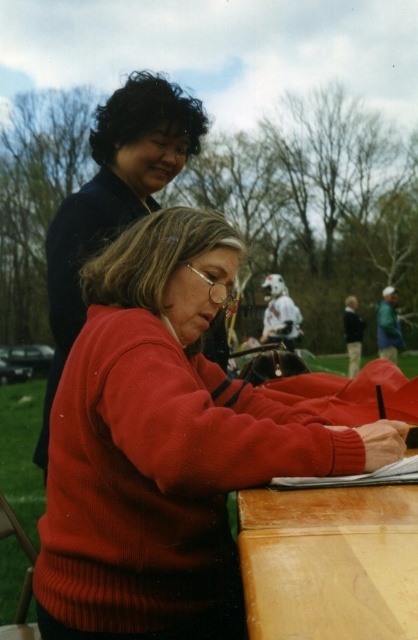
Question: Which of the following is the farthest from the observer?

Choices:
 (A) matte black sweater at upper left
 (B) knitted red sweater at center

Answer: (A)

Question: Is knitted red sweater at center smaller than matte black sweater at upper left?

Choices:
 (A) no
 (B) yes

Answer: (B)

Question: Which of the following is the closest to the observer?

Choices:
 (A) knitted red sweater at center
 (B) wooden table at lower center

Answer: (B)

Question: Does wooden table at lower center have a greater width compared to matte black sweater at upper left?

Choices:
 (A) no
 (B) yes

Answer: (A)

Question: Among these objects, which one is nearest to the camera?

Choices:
 (A) matte black sweater at upper left
 (B) knitted red sweater at center
 (C) wooden table at lower center

Answer: (C)

Question: Considering the relative positions of knitted red sweater at center and matte black sweater at upper left in the image provided, where is knitted red sweater at center located with respect to matte black sweater at upper left?

Choices:
 (A) above
 (B) below

Answer: (B)